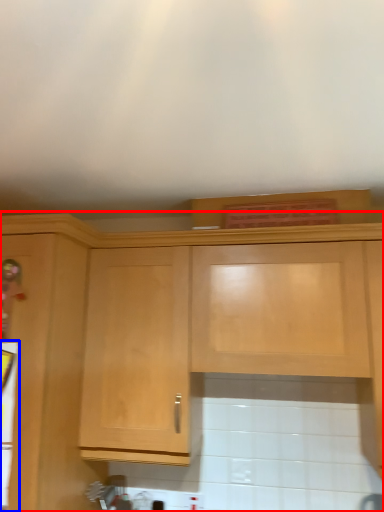
Question: Which point is closer to the camera, cabinetry (highlighted by a red box) or appliance (highlighted by a blue box)?

Choices:
 (A) cabinetry
 (B) appliance

Answer: (A)